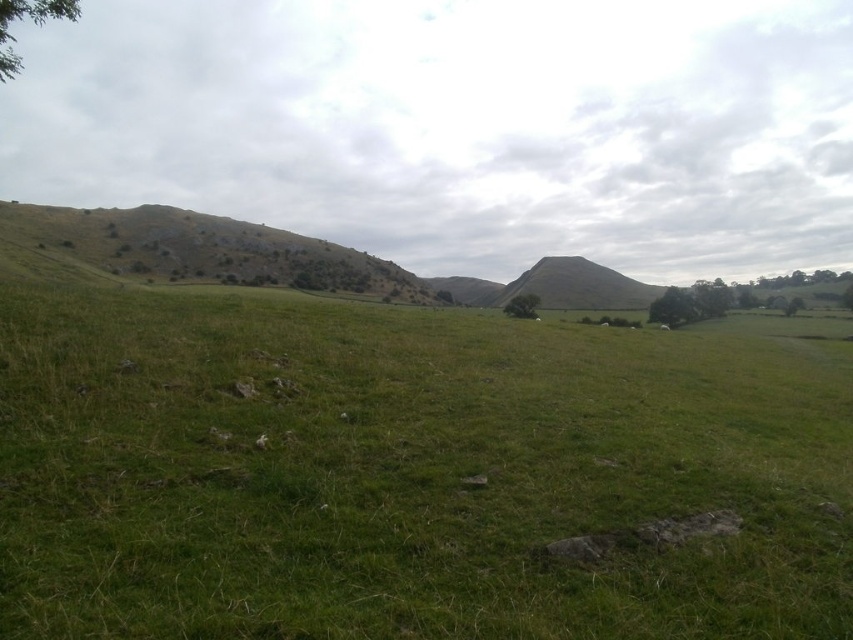
Question: Does green grassy field at center have a larger size compared to green grassy hillside at left?

Choices:
 (A) yes
 (B) no

Answer: (B)

Question: Which point is farther from the camera taking this photo?

Choices:
 (A) (468, 371)
 (B) (234, 224)

Answer: (B)

Question: Is green grassy hillside at left wider than green grassy hillside at center?

Choices:
 (A) yes
 (B) no

Answer: (A)

Question: Based on their relative distances, which object is farther from the green grassy hillside at center?

Choices:
 (A) green grassy hillside at left
 (B) green leafy tree at right
 (C) green grassy field at center

Answer: (C)

Question: Can you confirm if green grassy field at center is wider than green leafy tree at center?

Choices:
 (A) yes
 (B) no

Answer: (A)

Question: Among these objects, which one is nearest to the camera?

Choices:
 (A) green leafy tree at right
 (B) green grassy hillside at left
 (C) green leafy tree at center
 (D) green grassy hillside at center

Answer: (B)